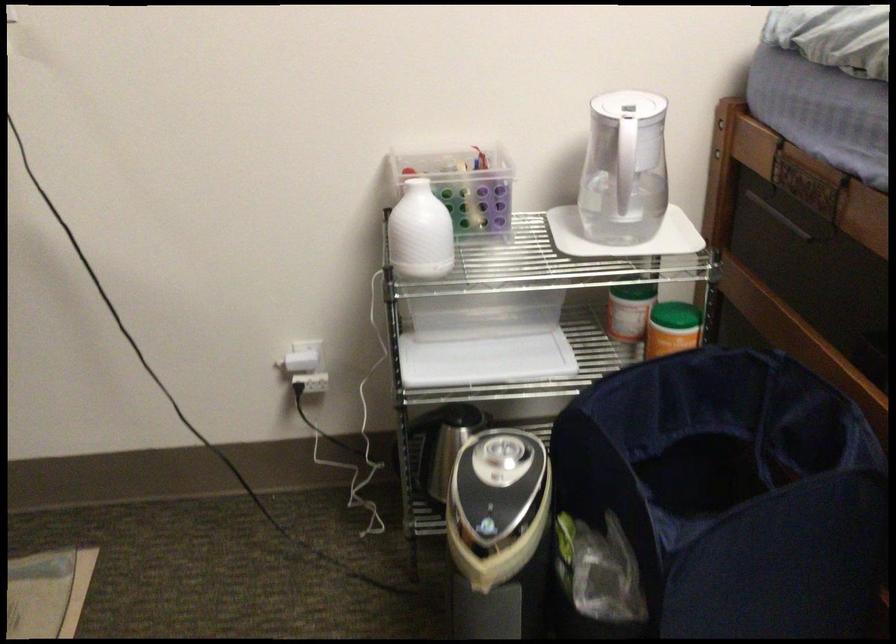
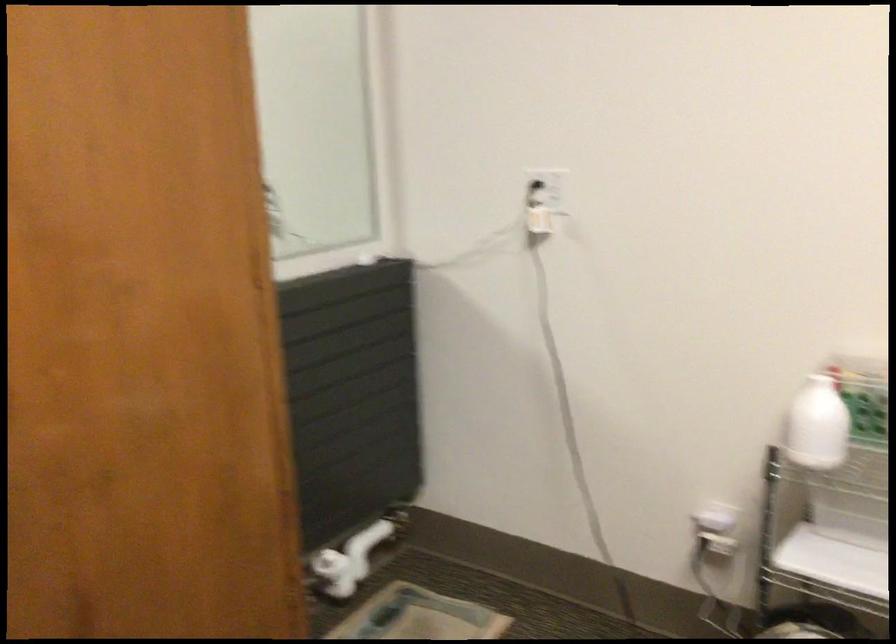
Question: How did the camera likely rotate?

Choices:
 (A) Left
 (B) Right
 (C) Up
 (D) Down

Answer: (A)